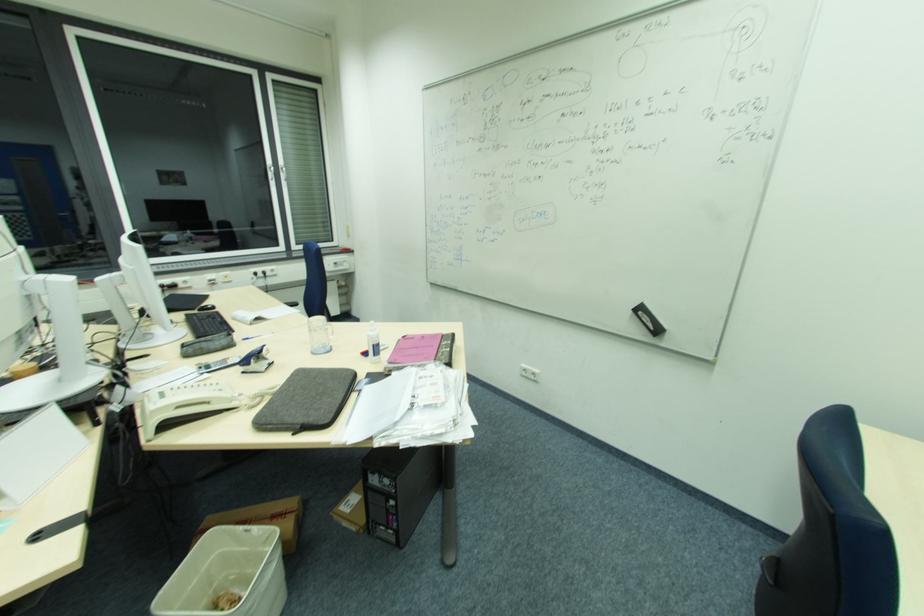
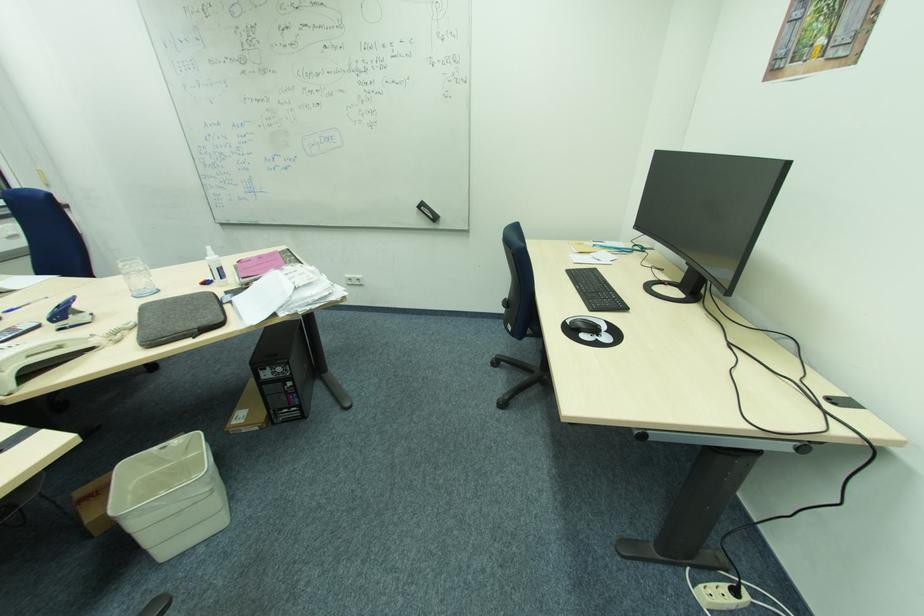
In the second image, find the point that corresponds to (x=210, y=403) in the first image.

(64, 347)